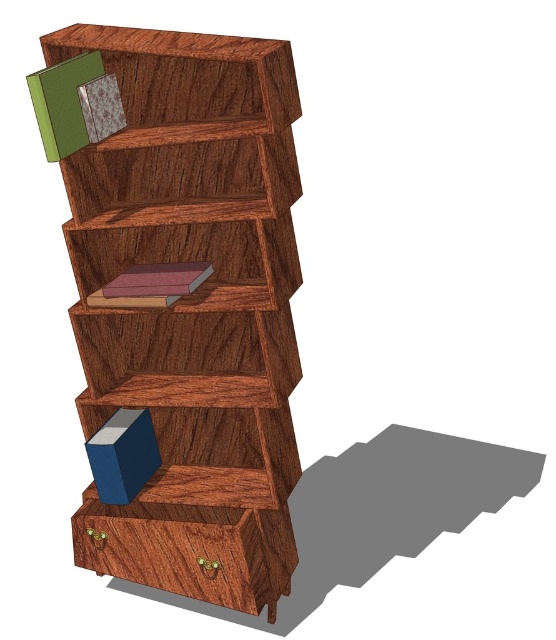
Question: Based on their relative distances, which object is farther from the green matte book at upper left?

Choices:
 (A) wooden bookcase at center
 (B) wooden bookshelf at center

Answer: (B)

Question: Can you confirm if wooden drawer at lower center is positioned below matte pink book at center?

Choices:
 (A) yes
 (B) no

Answer: (A)

Question: Can you confirm if wooden bookcase at center is bigger than blue matte book at lower center?

Choices:
 (A) no
 (B) yes

Answer: (B)

Question: Does wooden drawer at lower center have a lesser width compared to blue matte book at lower center?

Choices:
 (A) no
 (B) yes

Answer: (A)

Question: Which object appears closest to the camera in this image?

Choices:
 (A) green matte book at upper left
 (B) wooden bookshelf at center
 (C) wooden bookcase at center
 (D) wooden drawer at lower center

Answer: (C)

Question: Which object is positioned farthest from the wooden bookshelf at center?

Choices:
 (A) green matte book at upper left
 (B) blue matte book at lower center

Answer: (B)